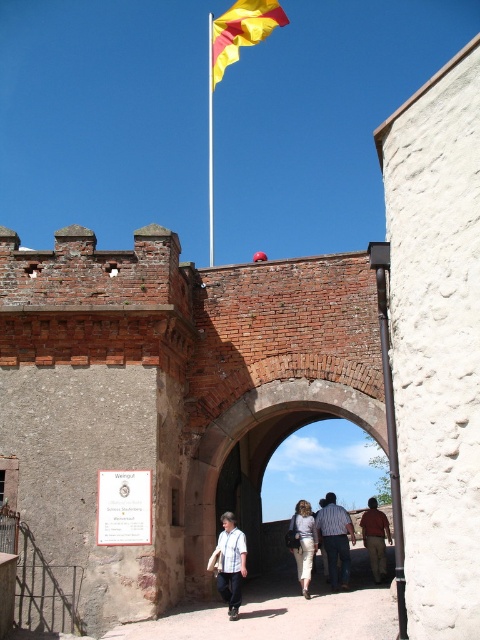
Question: Is the position of white shirt at center more distant than that of striped cotton shirt at center?

Choices:
 (A) no
 (B) yes

Answer: (A)

Question: Which object appears farthest from the camera in this image?

Choices:
 (A) white shirt at center
 (B) brown leather jacket at center
 (C) metallic flagpole at upper center

Answer: (C)

Question: Which point is closer to the camera?

Choices:
 (A) metallic flagpole at upper center
 (B) striped cotton shirt at center
 (C) brick wall at center

Answer: (C)

Question: Is brick wall at center to the left of brown leather jacket at center from the viewer's perspective?

Choices:
 (A) no
 (B) yes

Answer: (B)

Question: Which point is closer to the camera taking this photo?

Choices:
 (A) (211, 406)
 (B) (228, 588)

Answer: (B)

Question: Where is striped cotton shirt at center located in relation to light beige skirt at center in the image?

Choices:
 (A) right
 (B) left

Answer: (A)